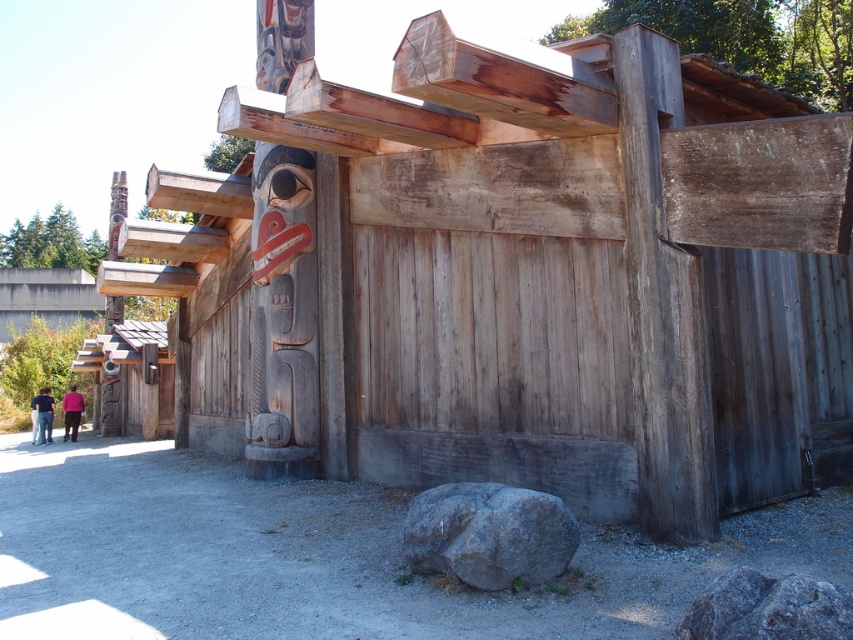
Between gray rough rock at lower center and gray rough rock at lower right, which one has less height?

gray rough rock at lower right is shorter.

Does gray rough rock at lower center have a greater height compared to gray rough rock at lower right?

Yes.

Which is in front, point (454, 522) or point (685, 621)?

Point (685, 621) is more forward.

I want to click on gray rough rock at lower center, so click(489, 534).

Can you confirm if gray rough rock at lower right is positioned below pink fabric at lower left?

Actually, gray rough rock at lower right is above pink fabric at lower left.

Does gray rough rock at lower right have a greater height compared to pink fabric at lower left?

Incorrect, gray rough rock at lower right's height is not larger of pink fabric at lower left's.

Is point (824, 580) closer to camera compared to point (78, 403)?

Yes, it is in front of point (78, 403).

Locate an element on the screen. Image resolution: width=853 pixels, height=640 pixels. gray rough rock at lower right is located at coordinates (767, 609).

Can you confirm if gray rough rock at lower right is thinner than dark blue shirt at lower left?

Yes.

Who is more distant from viewer, [807,620] or [41,422]?

The point [41,422] is behind.

The height and width of the screenshot is (640, 853). Find the location of `gray rough rock at lower right`. gray rough rock at lower right is located at coordinates (767, 609).